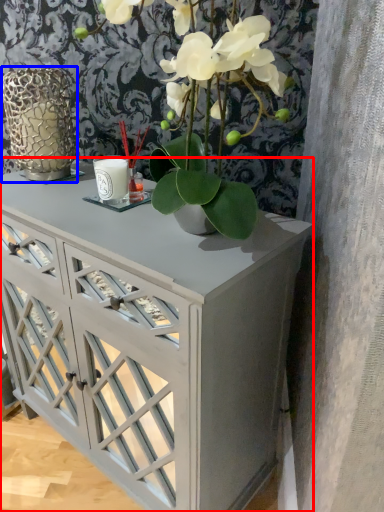
Question: Among these objects, which one is farthest to the camera, table (highlighted by a red box) or glass vase (highlighted by a blue box)?

Choices:
 (A) table
 (B) glass vase

Answer: (B)